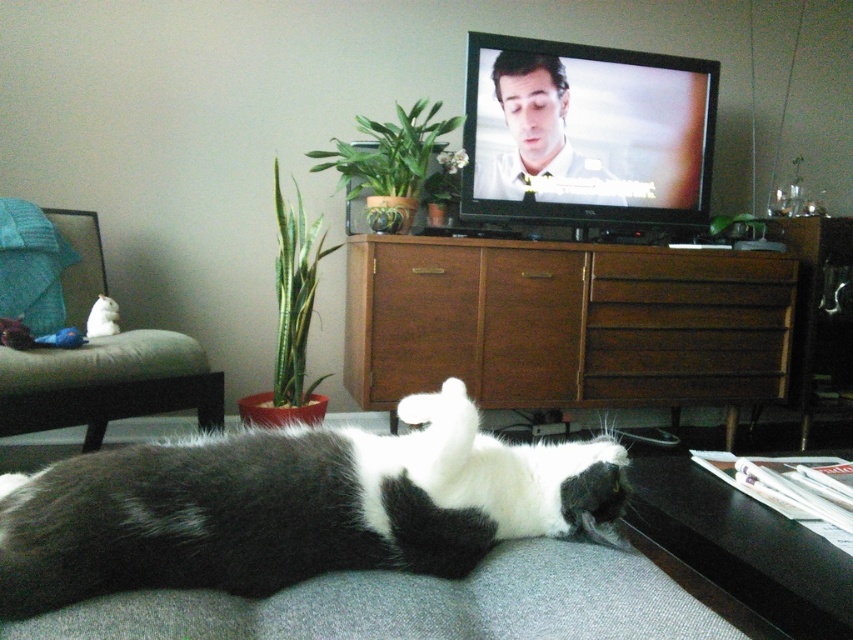
Looking at this image, you are a delivery person entering the living room and need to place a small package on the brown wood dresser at center. However, there is a black and white fur cat at lower center in the way. Can you place the package directly on the dresser without moving the cat?

The black and white fur cat at lower center is in front of the brown wood dresser at center, so you can still place the package on the dresser by moving around the cat to access the dresser from another angle.